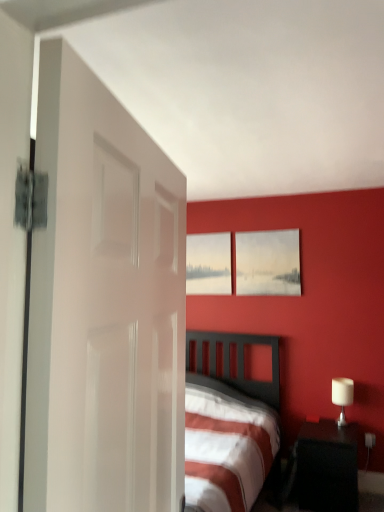
Describe the element at coordinates (208, 264) in the screenshot. The width and height of the screenshot is (384, 512). I see `matte gray picture frame at upper center, arranged as the second picture frame when viewed from the front` at that location.

What is the approximate height of white glossy door at left?

white glossy door at left is 1.04 meters in height.

Where is `matte gray picture frame at upper center, the first picture frame positioned from the back`? matte gray picture frame at upper center, the first picture frame positioned from the back is located at coordinates (208, 264).

Could you tell me if black glossy nightstand at lower right is turned towards white glossy door at left?

Yes.

In the image, is black glossy nightstand at lower right on the left side or the right side of white glossy door at left?

Clearly, black glossy nightstand at lower right is on the right of white glossy door at left in the image.

Can you confirm if black glossy nightstand at lower right is wider than white glossy door at left?

Yes.

Based on the photo, is black glossy nightstand at lower right far from white glossy door at left?

Yes.

From a real-world perspective, is white glossy table lamp at right on white glossy door at left?

No, from a real-world perspective, white glossy table lamp at right is not above white glossy door at left.

Do you think white glossy table lamp at right is within white glossy door at left, or outside of it?

white glossy table lamp at right lies outside white glossy door at left.

Is white glossy table lamp at right thinner than white glossy door at left?

Incorrect, the width of white glossy table lamp at right is not less than that of white glossy door at left.

Which object is closer to the camera, white glossy table lamp at right or white glossy door at left?

white glossy door at left is in front.

In the scene shown: Who is taller, black glossy nightstand at lower right or matte white picture frame at upper center, the 2th picture frame when ordered from left to right?

With more height is matte white picture frame at upper center, the 2th picture frame when ordered from left to right.

From a real-world perspective, which object rests below the other?

In real-world perspective, black glossy nightstand at lower right is lower.

Considering the relative positions of black glossy nightstand at lower right and matte white picture frame at upper center, the 1th picture frame from the right, in the image provided, is black glossy nightstand at lower right to the right of matte white picture frame at upper center, the 1th picture frame from the right, from the viewer's perspective?

Indeed, black glossy nightstand at lower right is positioned on the right side of matte white picture frame at upper center, the 1th picture frame from the right.

Can you tell me how much black glossy nightstand at lower right and matte white picture frame at upper center, the 2th picture frame when ordered from left to right, differ in facing direction?

0.993 degrees separate the facing orientations of black glossy nightstand at lower right and matte white picture frame at upper center, the 2th picture frame when ordered from left to right.

Based on the photo, from the image's perspective, which one is positioned higher, white glossy table lamp at right or black glossy nightstand at lower right?

white glossy table lamp at right is shown above in the image.

Considering the sizes of objects white glossy table lamp at right and black glossy nightstand at lower right in the image provided, who is bigger, white glossy table lamp at right or black glossy nightstand at lower right?

black glossy nightstand at lower right is bigger.

Find the location of a particular element. This screenshot has width=384, height=512. table lamp above the black glossy nightstand at lower right (from the image's perspective) is located at coordinates (342, 396).

Considering the sizes of white glossy table lamp at right and black glossy nightstand at lower right in the image, is white glossy table lamp at right taller or shorter than black glossy nightstand at lower right?

white glossy table lamp at right is shorter than black glossy nightstand at lower right.

Are white glossy door at left and matte white picture frame at upper center, the 2th picture frame when ordered from back to front, located far from each other?

Yes, white glossy door at left is far from matte white picture frame at upper center, the 2th picture frame when ordered from back to front.

Considering the positions of point (42, 133) and point (254, 289), is point (42, 133) closer or farther from the camera than point (254, 289)?

Point (42, 133).

Considering the sizes of white glossy door at left and matte white picture frame at upper center, the 2th picture frame when ordered from back to front, in the image, is white glossy door at left wider or thinner than matte white picture frame at upper center, the 2th picture frame when ordered from back to front,?

Considering their sizes, white glossy door at left looks broader than matte white picture frame at upper center, the 2th picture frame when ordered from back to front.

From a real-world perspective, which object stands above the other?

matte white picture frame at upper center, the 2th picture frame when ordered from left to right, from a real-world perspective.

Could you tell me if matte white picture frame at upper center, the first picture frame when ordered from front to back, is facing black glossy nightstand at lower right?

No, matte white picture frame at upper center, the first picture frame when ordered from front to back, is not aimed at black glossy nightstand at lower right.

Is matte white picture frame at upper center, the 2th picture frame when ordered from back to front, located outside black glossy nightstand at lower right?

That's correct, matte white picture frame at upper center, the 2th picture frame when ordered from back to front, is outside of black glossy nightstand at lower right.

You are a GUI agent. You are given a task and a screenshot of the screen. Output one action in this format:
    pyautogui.click(x=<x>, y=<y>)
    Task: Click on the 2nd picture frame above when counting from the black glossy nightstand at lower right (from the image's perspective)
    The width and height of the screenshot is (384, 512).
    Given the screenshot: What is the action you would take?
    pyautogui.click(x=268, y=263)

Consider the image. Who is bigger, matte white picture frame at upper center, the 1th picture frame from the right, or black glossy nightstand at lower right?

black glossy nightstand at lower right.

Is the position of matte gray picture frame at upper center, placed as the 2th picture frame when sorted from right to left, less distant than that of black glossy nightstand at lower right?

No, it is behind black glossy nightstand at lower right.

Where is `the 2nd picture frame behind the black glossy nightstand at lower right, counting from the anchor's position`? The width and height of the screenshot is (384, 512). the 2nd picture frame behind the black glossy nightstand at lower right, counting from the anchor's position is located at coordinates (208, 264).

Who is taller, matte gray picture frame at upper center, the first picture frame positioned from the back, or black glossy nightstand at lower right?

Standing taller between the two is matte gray picture frame at upper center, the first picture frame positioned from the back.

Which is farther, (230, 241) or (308, 446)?

The point (230, 241) is farther.

Locate an element on the screen. door above the black glossy nightstand at lower right (from a real-world perspective) is located at coordinates (103, 305).

Find the location of `table lamp behind the white glossy door at left`. table lamp behind the white glossy door at left is located at coordinates (342, 396).

Based on their spatial positions, is matte gray picture frame at upper center, arranged as the second picture frame when viewed from the front, or black glossy nightstand at lower right further from white glossy door at left?

matte gray picture frame at upper center, arranged as the second picture frame when viewed from the front.

Estimate the real-world distances between objects in this image. Which object is further from white glossy table lamp at right, matte gray picture frame at upper center, placed as the 2th picture frame when sorted from right to left, or black glossy nightstand at lower right?

matte gray picture frame at upper center, placed as the 2th picture frame when sorted from right to left, is further to white glossy table lamp at right.

Estimate the real-world distances between objects in this image. Which object is closer to white glossy door at left, black glossy nightstand at lower right or matte gray picture frame at upper center, the first picture frame positioned from the back?

black glossy nightstand at lower right lies closer to white glossy door at left than the other object.

Looking at the image, which one is located further to matte gray picture frame at upper center, placed as the 2th picture frame when sorted from right to left, matte white picture frame at upper center, the 2th picture frame when ordered from left to right, or white glossy table lamp at right?

The object further to matte gray picture frame at upper center, placed as the 2th picture frame when sorted from right to left, is white glossy table lamp at right.

Estimate the real-world distances between objects in this image. Which object is further from matte white picture frame at upper center, the 2th picture frame when ordered from left to right, matte gray picture frame at upper center, which ranks as the 1th picture frame in left-to-right order, or white glossy table lamp at right?

Based on the image, white glossy table lamp at right appears to be further to matte white picture frame at upper center, the 2th picture frame when ordered from left to right.

Considering their positions, is white glossy door at left positioned further to matte gray picture frame at upper center, arranged as the second picture frame when viewed from the front, than black glossy nightstand at lower right?

white glossy door at left.

From the picture: From the image, which object appears to be farther from white glossy table lamp at right, matte gray picture frame at upper center, placed as the 2th picture frame when sorted from right to left, or white glossy door at left?

white glossy door at left is further to white glossy table lamp at right.

From the image, which object appears to be farther from matte gray picture frame at upper center, the first picture frame positioned from the back, black glossy nightstand at lower right or white glossy table lamp at right?

The object further to matte gray picture frame at upper center, the first picture frame positioned from the back, is black glossy nightstand at lower right.

The height and width of the screenshot is (512, 384). Identify the location of nightstand between white glossy door at left and white glossy table lamp at right from front to back. (327, 467).

Image resolution: width=384 pixels, height=512 pixels. I want to click on nightstand between white glossy door at left and matte white picture frame at upper center, the 2th picture frame when ordered from left to right, along the z-axis, so click(x=327, y=467).

Where is `nightstand positioned between white glossy door at left and matte gray picture frame at upper center, arranged as the second picture frame when viewed from the front, from near to far`? Image resolution: width=384 pixels, height=512 pixels. nightstand positioned between white glossy door at left and matte gray picture frame at upper center, arranged as the second picture frame when viewed from the front, from near to far is located at coordinates pyautogui.click(x=327, y=467).

The image size is (384, 512). I want to click on table lamp that lies between matte white picture frame at upper center, the 1th picture frame from the right, and black glossy nightstand at lower right from top to bottom, so click(x=342, y=396).